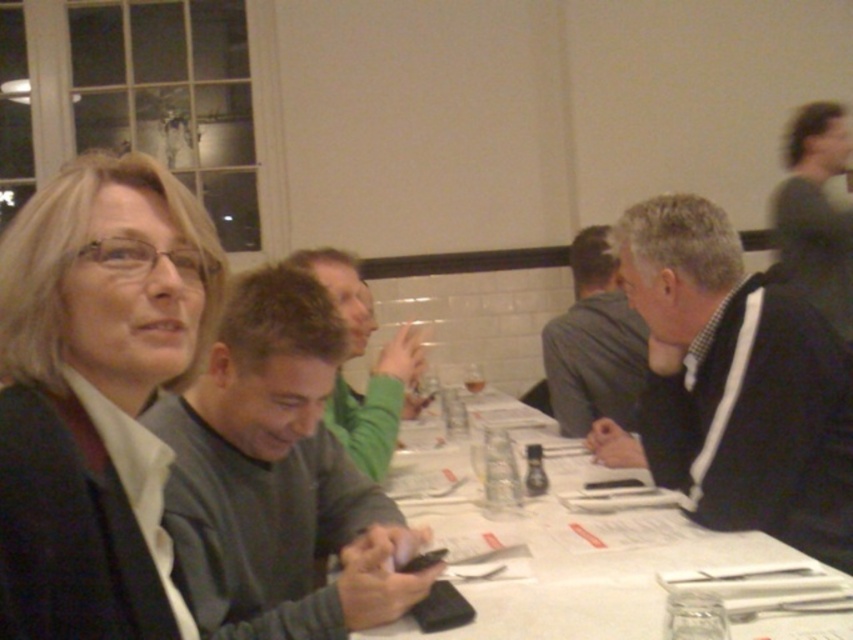
Is matte black jacket at left closer to the viewer compared to transparent glass at table center?

Yes, matte black jacket at left is closer to the viewer.

Between point (3, 538) and point (712, 612), which one is positioned behind?

Point (712, 612)

I want to click on matte black jacket at left, so click(x=96, y=396).

Looking at this image, between black sweater at right and transparent glass at table center, which one appears on the left side from the viewer's perspective?

From the viewer's perspective, transparent glass at table center appears more on the left side.

Is black sweater at right above transparent glass at table center?

Yes.

Find the location of a particular element. Image resolution: width=853 pixels, height=640 pixels. black sweater at right is located at coordinates (737, 384).

Can you confirm if matte black jacket at left is positioned above white paper at center?

Correct, matte black jacket at left is located above white paper at center.

Is point (13, 488) positioned behind point (494, 422)?

No, (13, 488) is closer to viewer.

Identify the location of matte black jacket at left. (96, 396).